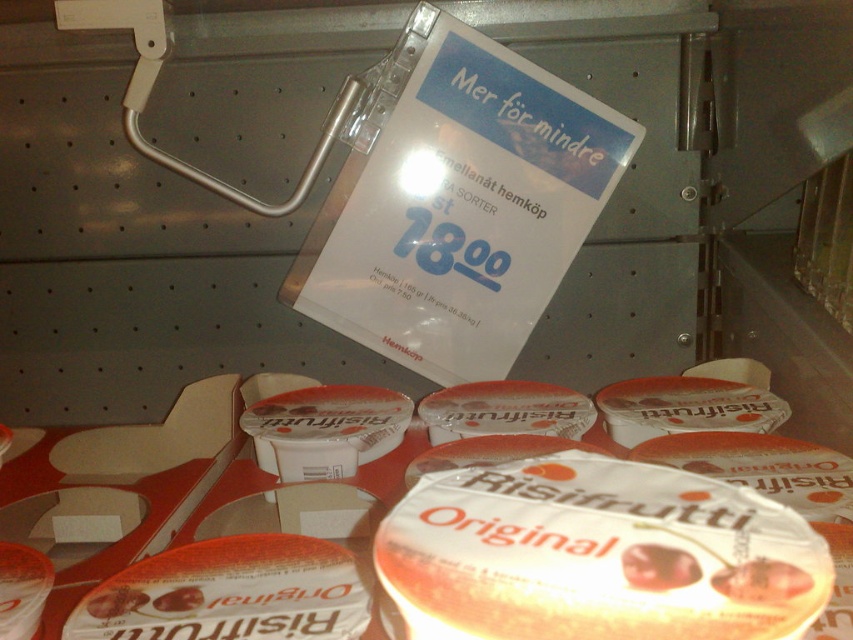
You are a customer at the store looking at the yogurt section. You see a translucent plastic cup at center and a white matte risifrutti original at center. Which one is located to the right?

The translucent plastic cup at center is positioned on the right side of white matte risifrutti original at center, so the translucent plastic cup at center is located to the right.